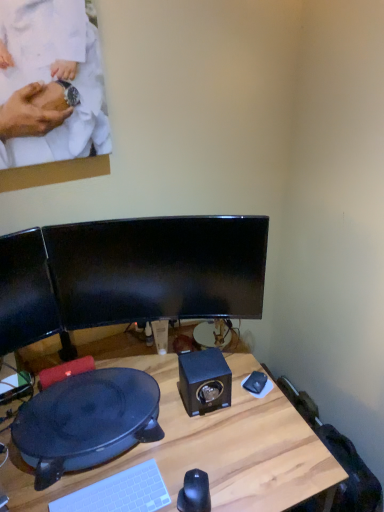
Locate an element on the screen. The width and height of the screenshot is (384, 512). free spot behind white plastic keyboard at lower center is located at coordinates pos(134,453).